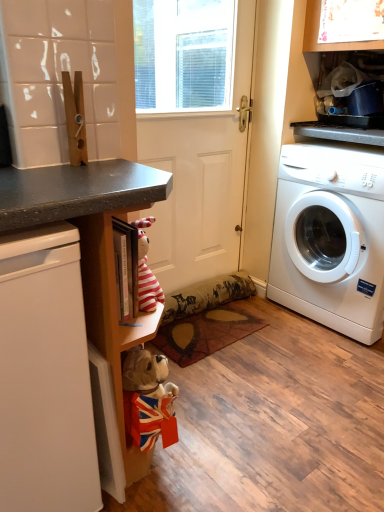
Where is `vacant point to the right of patterned fabric mat at center`? This screenshot has width=384, height=512. vacant point to the right of patterned fabric mat at center is located at coordinates (292, 340).